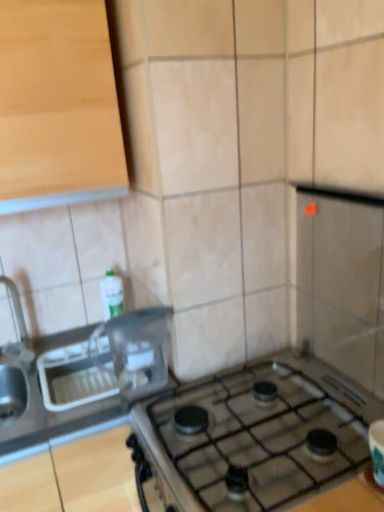
Question: Looking at their shapes, would you say light wood cabinet at upper left is wider or thinner than satin silver sink at left?

Choices:
 (A) thin
 (B) wide

Answer: (A)

Question: From a real-world perspective, is light wood cabinet at upper left physically located above or below satin silver sink at left?

Choices:
 (A) above
 (B) below

Answer: (A)

Question: Which is nearer to the brushed metal faucet at left?

Choices:
 (A) satin silver sink at left
 (B) clear plastic container at center
 (C) light wood cabinet at upper left

Answer: (A)

Question: Estimate the real-world distances between objects in this image. Which object is closer to the light wood cabinet at upper left?

Choices:
 (A) brushed metal faucet at left
 (B) satin silver sink at left
 (C) clear plastic container at center

Answer: (C)